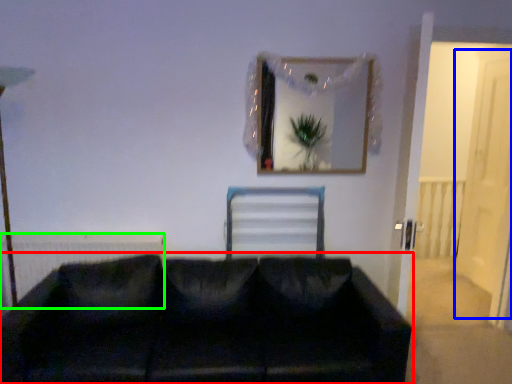
Question: Estimate the real-world distances between objects in this image. Which object is closer to studio couch (highlighted by a red box), glass door (highlighted by a blue box) or radiator (highlighted by a green box)?

Choices:
 (A) glass door
 (B) radiator

Answer: (B)